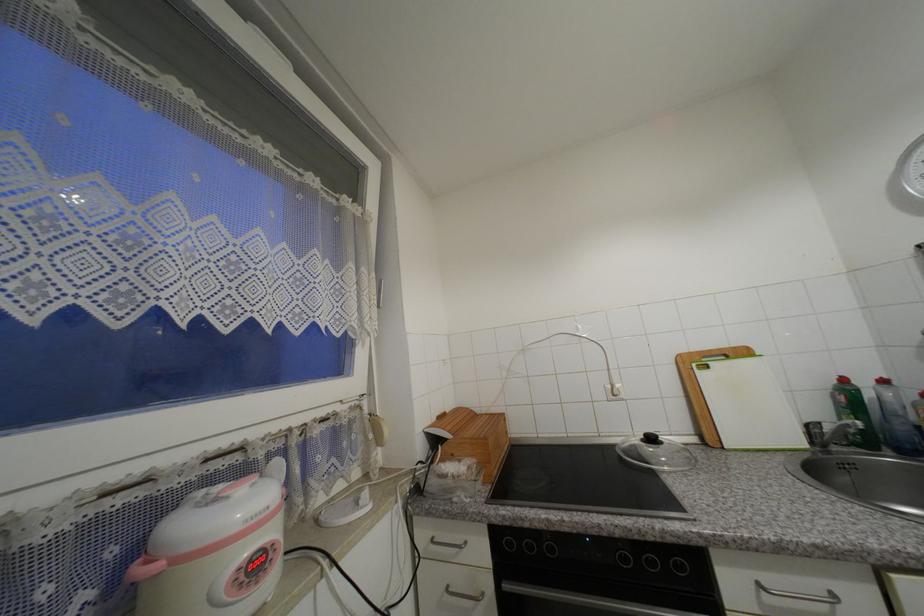
This screenshot has width=924, height=616. What are the coordinates of `wooden breadbox lid` in the screenshot? It's located at pos(703,387).